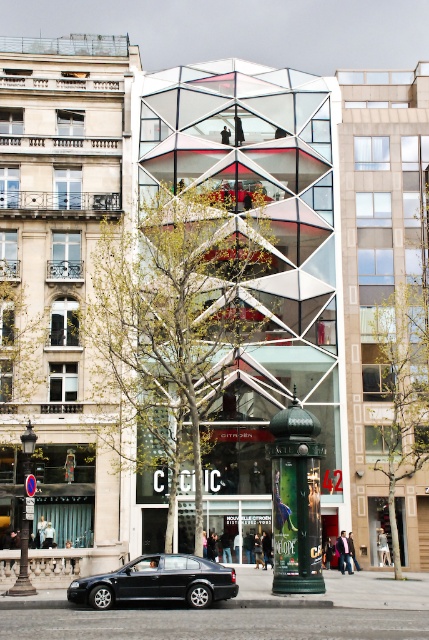
Question: Which is nearer to the green leafy tree at right?

Choices:
 (A) green metallic pillar at center
 (B) green leafy tree at center
 (C) shiny black sedan at lower left

Answer: (A)

Question: Can you confirm if green leafy tree at center is positioned to the right of green leafy tree at right?

Choices:
 (A) no
 (B) yes

Answer: (A)

Question: Does green leafy tree at center have a lesser width compared to shiny black sedan at lower left?

Choices:
 (A) no
 (B) yes

Answer: (A)

Question: Which point is farther to the camera?

Choices:
 (A) green leafy tree at right
 (B) shiny black sedan at lower left

Answer: (A)

Question: Does green leafy tree at center have a larger size compared to green leafy tree at right?

Choices:
 (A) no
 (B) yes

Answer: (B)

Question: Which point is closer to the camera?

Choices:
 (A) green leafy tree at right
 (B) green metallic pillar at center

Answer: (B)